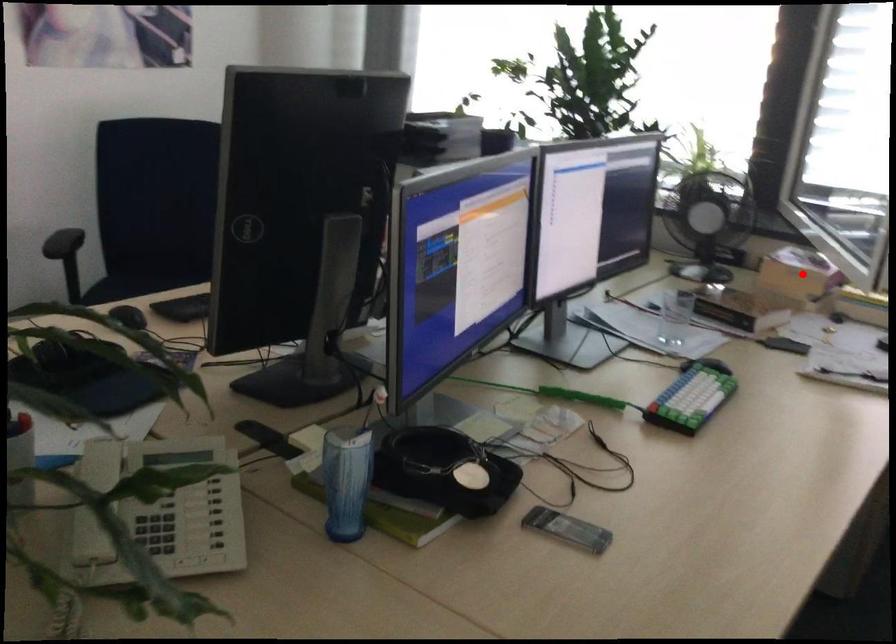
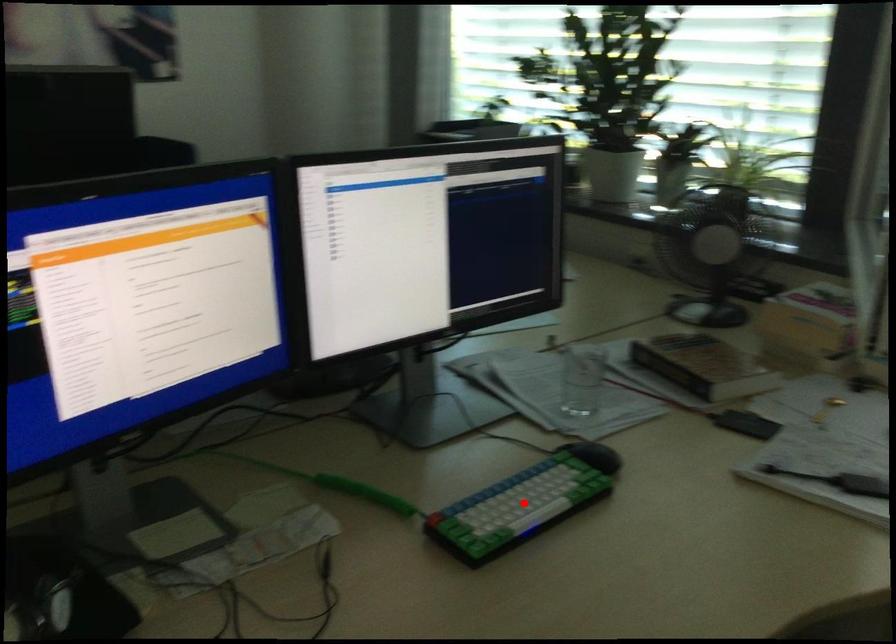
I am providing you with two images of the same scene from different viewpoints. A red point is marked on the first image and another point is marked on the second image. Is the red point in image1 aligned with the point shown in image2?

No